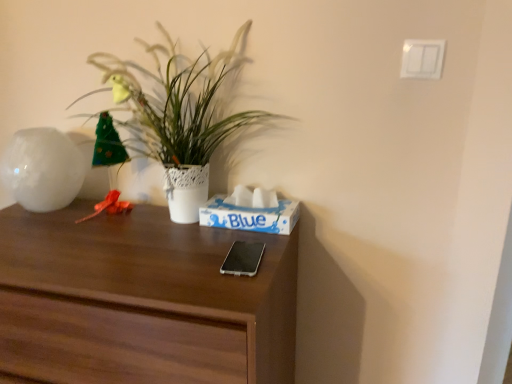
What are the coordinates of `vacant area that lies between white lace pot at upper left and silver metallic phone at center` in the screenshot? It's located at (182, 243).